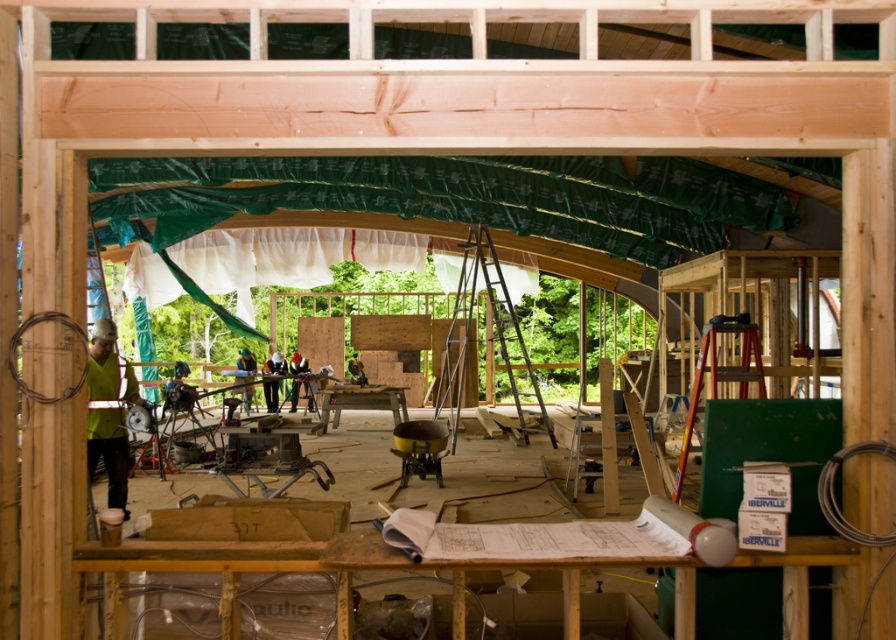
Which is more to the right, yellow fabric at left or green safety vest at center?

yellow fabric at left is more to the right.

Who is shorter, yellow fabric at left or green safety vest at center?

With less height is green safety vest at center.

Where is `yellow fabric at left`? The width and height of the screenshot is (896, 640). yellow fabric at left is located at coordinates (108, 412).

At what (x,y) coordinates should I click in order to perform the action: click on yellow fabric at left. Please return your answer as a coordinate pair (x, y). Looking at the image, I should click on (108, 412).

Does green safety vest at center lie behind green fabric at center?

No.

Between green safety vest at center and green fabric at center, which one has more height?

green fabric at center is taller.

Between point (272, 387) and point (254, 362), which one is positioned behind?

The point (272, 387) is behind.

Where is `green safety vest at center`? This screenshot has width=896, height=640. green safety vest at center is located at coordinates (272, 378).

Is point (136, 400) in front of point (248, 353)?

That is True.

Does yellow fabric at left have a larger size compared to green fabric at center?

Indeed, yellow fabric at left has a larger size compared to green fabric at center.

What do you see at coordinates (108, 412) in the screenshot? I see `yellow fabric at left` at bounding box center [108, 412].

This screenshot has height=640, width=896. Identify the location of yellow fabric at left. (108, 412).